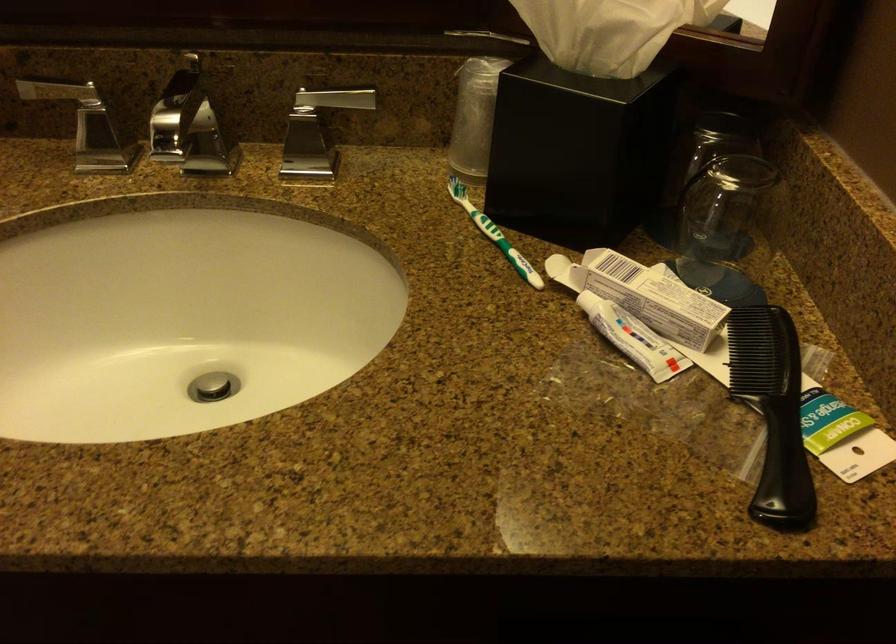
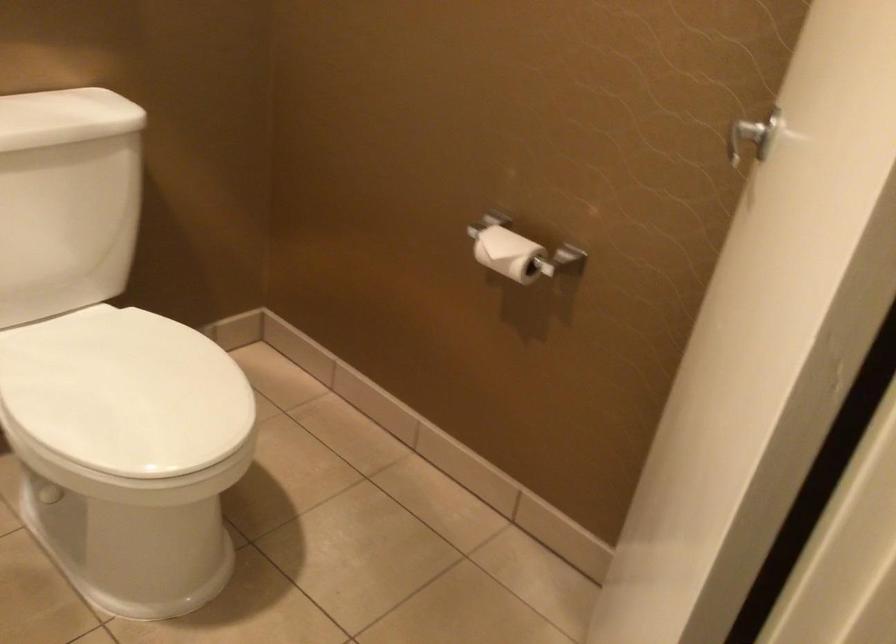
Question: How did the camera likely rotate?

Choices:
 (A) Left
 (B) Right
 (C) Up
 (D) Down

Answer: (A)